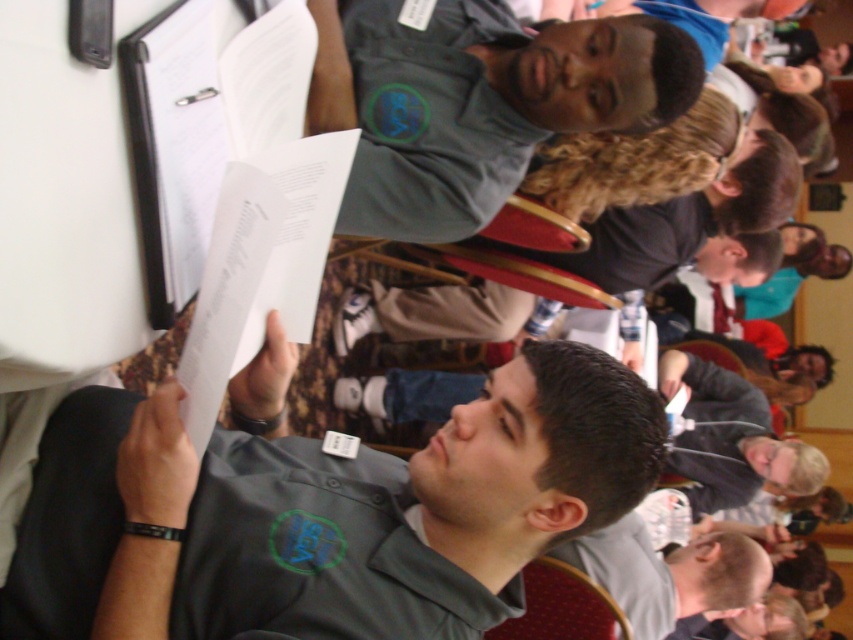
Question: Which point is farther from the camera taking this photo?

Choices:
 (A) (763, 564)
 (B) (412, 188)
 (C) (634, 420)

Answer: (A)

Question: Which point is closer to the camera?

Choices:
 (A) (433, 317)
 (B) (788, 464)

Answer: (A)

Question: Does gray fleece jacket at lower right have a greater width compared to gray matte shirt at lower right?

Choices:
 (A) yes
 (B) no

Answer: (B)

Question: Can you confirm if gray fleece jacket at lower right is wider than gray matte shirt at lower right?

Choices:
 (A) yes
 (B) no

Answer: (B)

Question: Is dark gray shirt at upper center positioned in front of gray matte shirt at lower right?

Choices:
 (A) yes
 (B) no

Answer: (B)

Question: Which point is farther to the camera?

Choices:
 (A) (592, 566)
 (B) (682, 49)
 (C) (686, 232)

Answer: (C)